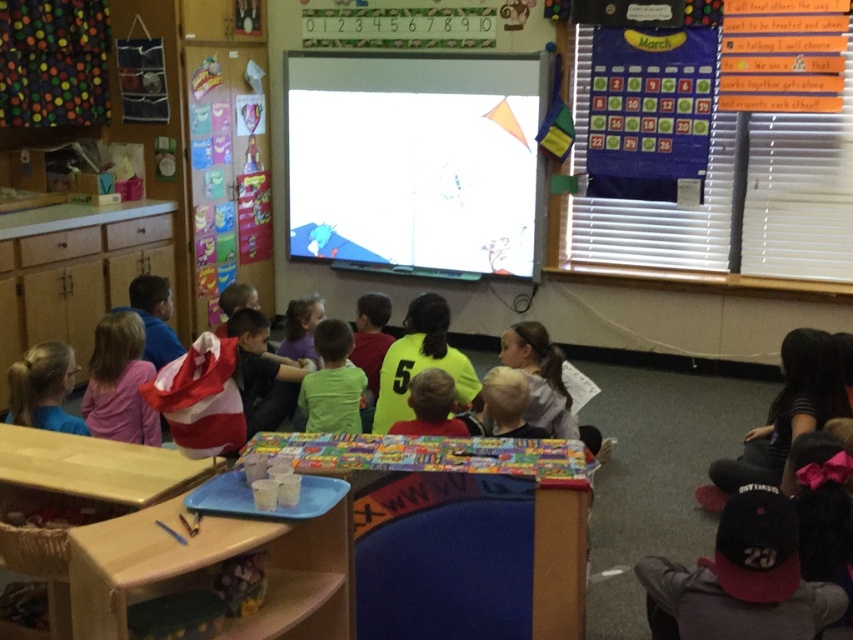
Question: Can you confirm if black fabric at lower right is smaller than green matte shirt at center?

Choices:
 (A) yes
 (B) no

Answer: (B)

Question: In this image, where is black fabric at lower right located relative to matte yellow shirt at center?

Choices:
 (A) left
 (B) right

Answer: (B)

Question: Does pink fabric at left appear under matte yellow shirt at center?

Choices:
 (A) yes
 (B) no

Answer: (B)

Question: Which object is the closest to the black fabric at lower right?

Choices:
 (A) pink fabric at left
 (B) green matte shirt at center

Answer: (B)

Question: Which point is closer to the camera?

Choices:
 (A) matte yellow shirt at center
 (B) black fabric at lower right
 (C) green matte shirt at center

Answer: (A)

Question: Which point is farther to the camera?

Choices:
 (A) pink fabric at left
 (B) matte yellow shirt at center
 (C) black fabric at lower right
 (D) green matte shirt at center

Answer: (D)